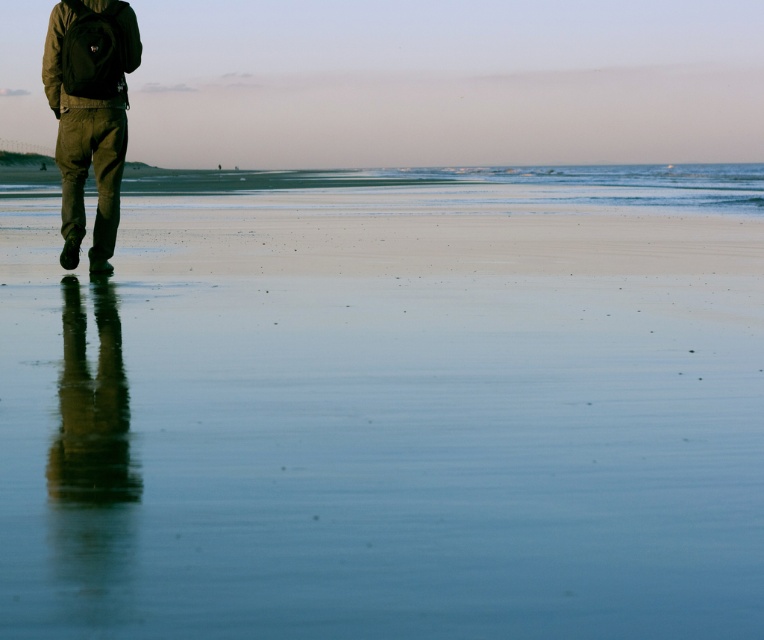
How far apart are smooth sand at lower left and olive green corduroy pants at left?

smooth sand at lower left is 4.01 meters from olive green corduroy pants at left.

Based on the photo, who is more forward, (332, 285) or (102, 189)?

Point (332, 285)

Where is `smooth sand at lower left`? The image size is (764, 640). smooth sand at lower left is located at coordinates (387, 404).